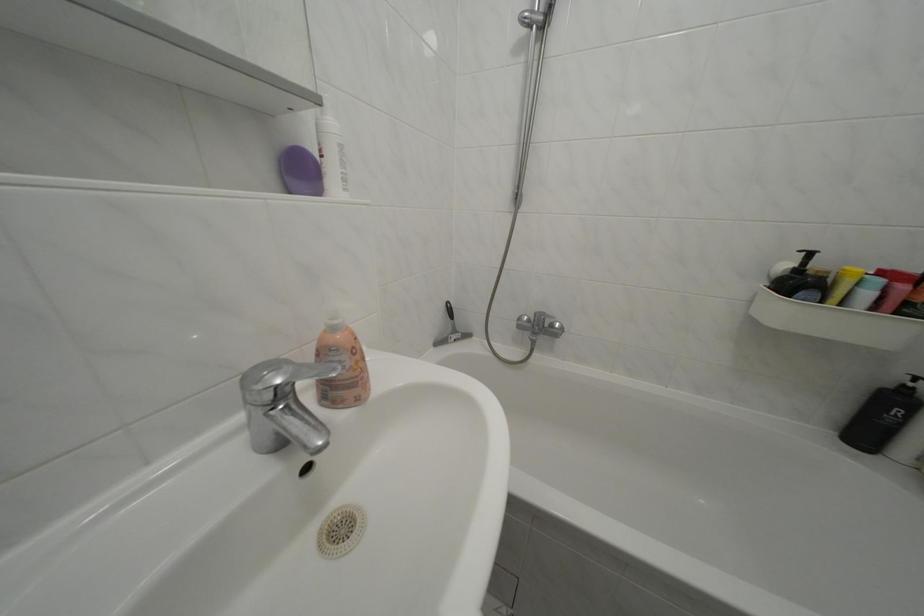
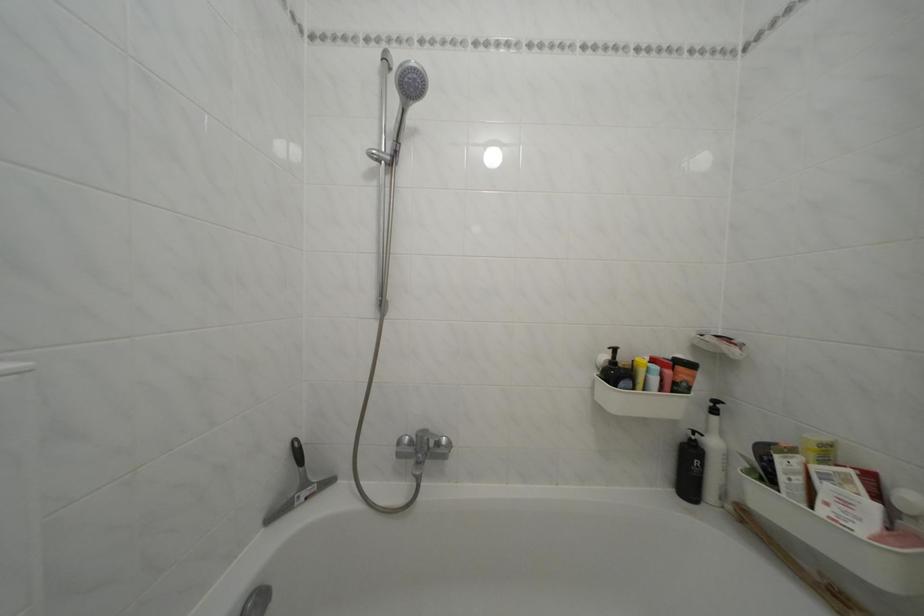
Based on the continuous images, in which direction is the camera rotating?

The camera rotated toward right-up.